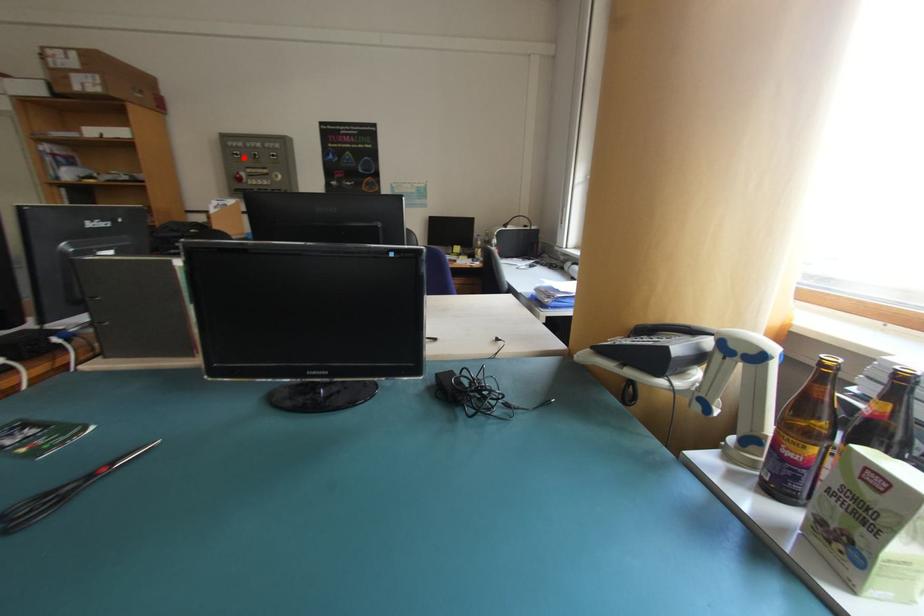
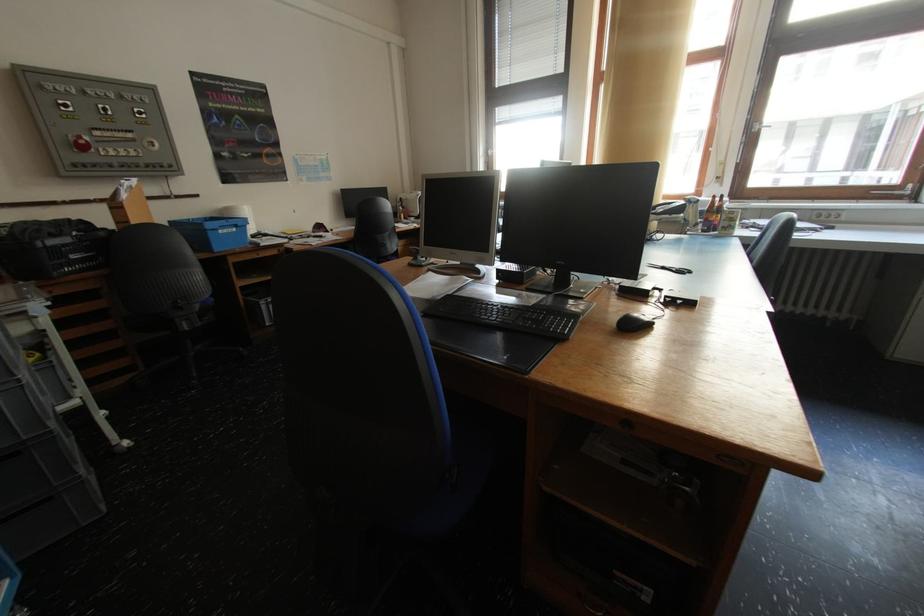
Question: I am providing you with two images of the same scene from different viewpoints. In image1, a red point is highlighted. Considering the same 3D point in image2, which of the following is correct?

Choices:
 (A) It is closer
 (B) It is farther

Answer: (B)